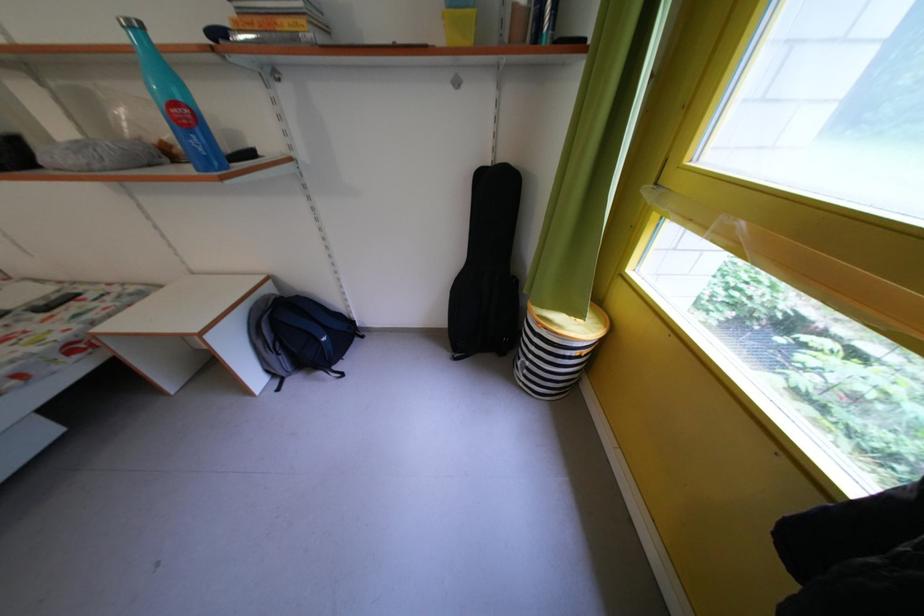
This screenshot has height=616, width=924. Find the location of `black guitar case`. black guitar case is located at coordinates (487, 268).